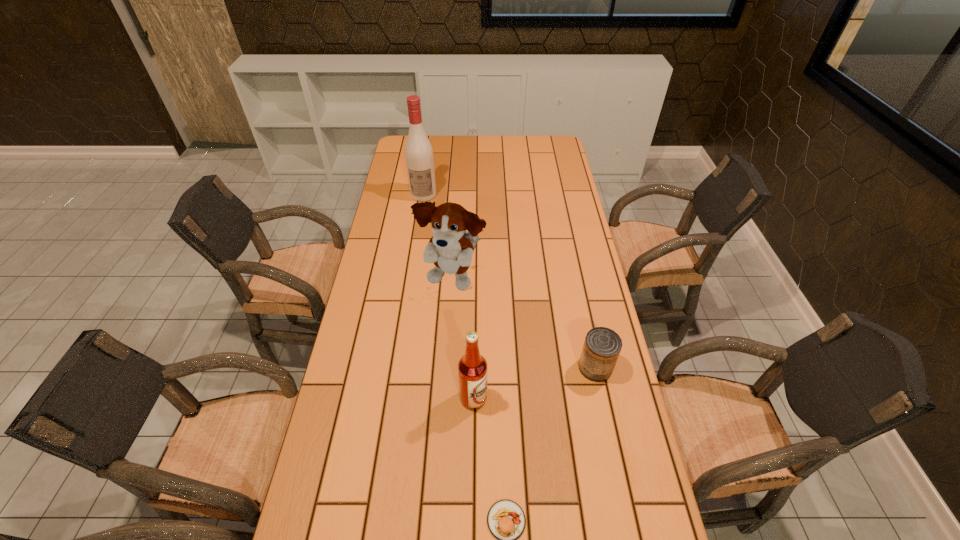
This screenshot has width=960, height=540. What are the coordinates of `free space located 0.050m on the left of the can` in the screenshot? It's located at (561, 368).

I want to click on object located in the left edge section of the desktop, so click(419, 157).

What are the coordinates of `object that is positioned at the right edge` in the screenshot? It's located at pos(602,346).

This screenshot has width=960, height=540. In the image, there is a desktop. Find the location of `vacant space at the far edge`. vacant space at the far edge is located at coordinates (520, 139).

Find the location of a particular element. vacant region at the left edge of the desktop is located at coordinates (363, 430).

Where is `free space at the right edge of the desktop`? free space at the right edge of the desktop is located at coordinates (605, 315).

Locate an element on the screen. The width and height of the screenshot is (960, 540). empty location between the left alcohol and the fourth tallest object is located at coordinates (510, 281).

Where is `vacant space in between the fourth nearest object and the fourth farthest object`? This screenshot has height=540, width=960. vacant space in between the fourth nearest object and the fourth farthest object is located at coordinates (463, 339).

Identify the location of vacant space that is in between the third tallest object and the rightmost object. The image size is (960, 540). (535, 383).

The height and width of the screenshot is (540, 960). Find the location of `vacant region between the second shortest object and the puppy`. vacant region between the second shortest object and the puppy is located at coordinates (524, 323).